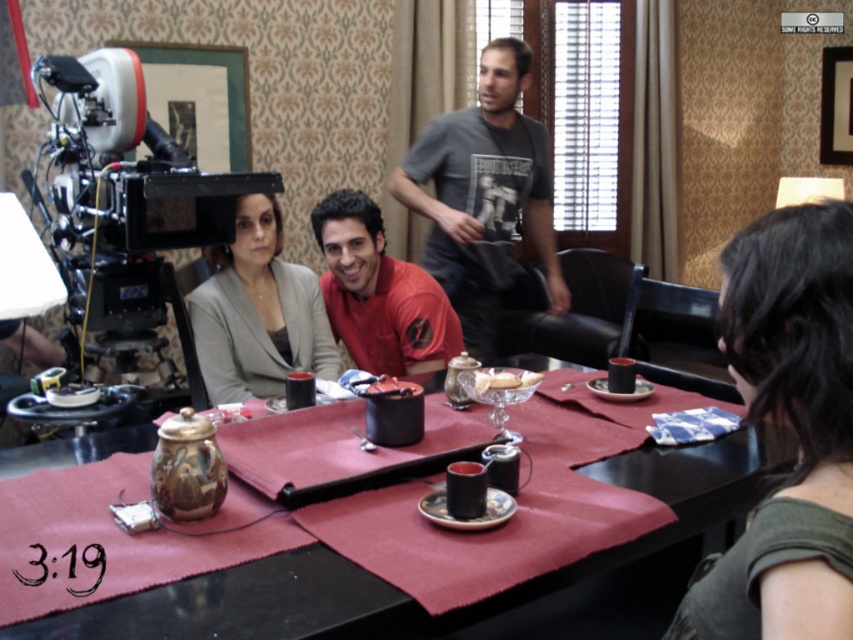
The image size is (853, 640). I want to click on green fabric shirt at right, so click(788, 426).

Who is lower down, maroon fabric table at center or white porcelain plate at center?

Positioned lower is maroon fabric table at center.

Between point (437, 632) and point (479, 384), which one is positioned in front?

Point (437, 632)

Identify the location of maroon fabric table at center. The height and width of the screenshot is (640, 853). (457, 609).

Which is behind, point (77, 84) or point (509, 378)?

Positioned behind is point (77, 84).

Between metallic black video camera at left and white porcelain plate at center, which one appears on the right side from the viewer's perspective?

white porcelain plate at center

Between point (96, 296) and point (532, 376), which one is positioned in front?

Point (532, 376) is more forward.

The image size is (853, 640). In order to click on metallic black video camera at left in this screenshot , I will do `click(125, 200)`.